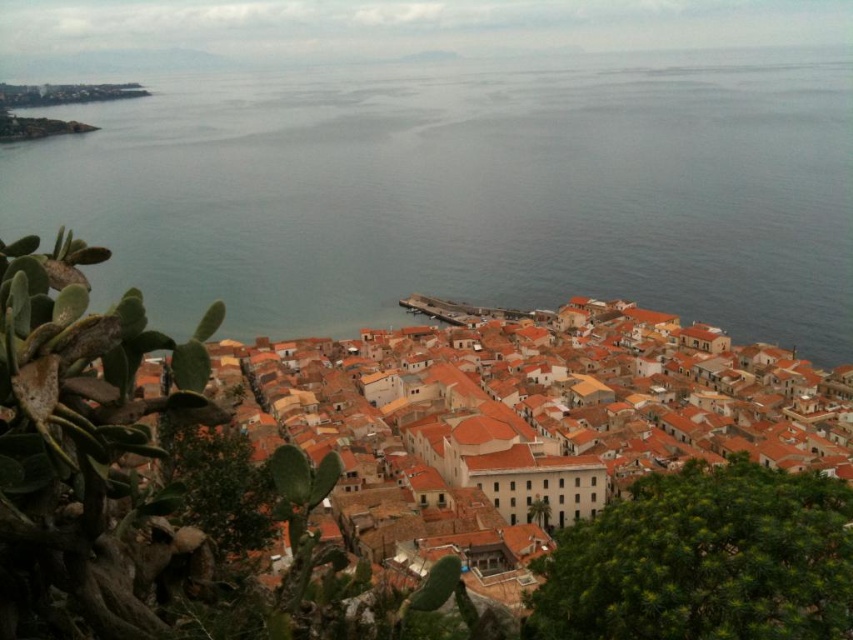
The image size is (853, 640). I want to click on smooth blue water at center, so click(x=467, y=189).

Which of these two, smooth blue water at center or orange clay rooftops at center, stands shorter?

orange clay rooftops at center is shorter.

Is point (196, 248) farther from viewer compared to point (462, 552)?

Yes.

The width and height of the screenshot is (853, 640). Find the location of `smooth blue water at center`. smooth blue water at center is located at coordinates (467, 189).